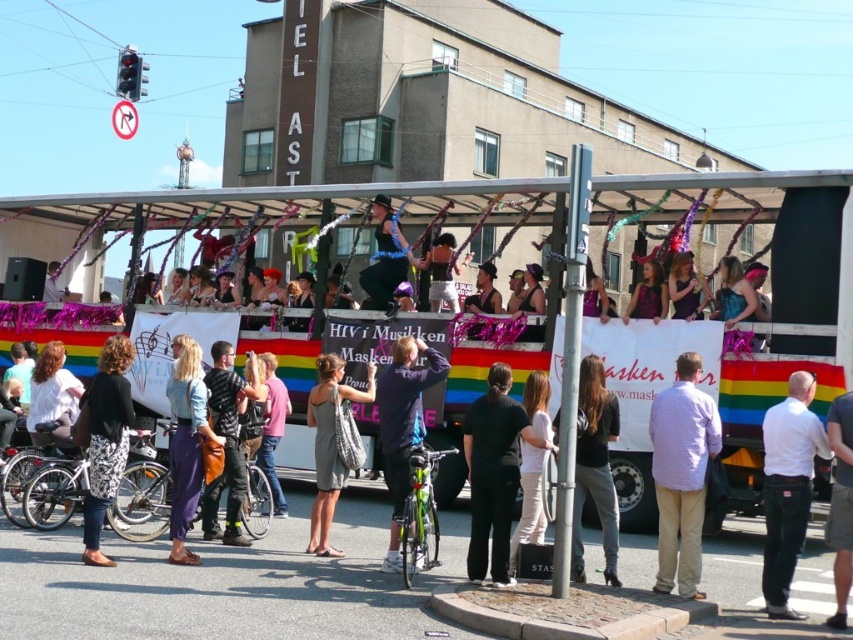
Question: Can you confirm if black matte pants at center is positioned to the left of pink fabric dress at center?

Choices:
 (A) no
 (B) yes

Answer: (A)

Question: Is light gray fabric bag at center below white matte shirt at center?

Choices:
 (A) yes
 (B) no

Answer: (A)

Question: Is matte purple pants at lower left above pink fabric dress at center?

Choices:
 (A) no
 (B) yes

Answer: (B)

Question: Which object is closer to the camera taking this photo?

Choices:
 (A) white cotton shirt at center
 (B) shiny blue dress at center
 (C) light purple checkered shirt at center

Answer: (A)

Question: Based on their relative distances, which object is farther from the white glossy float at center?

Choices:
 (A) shiny blue dress at center
 (B) black printed skirt at lower left

Answer: (B)

Question: Which object appears closest to the camera in this image?

Choices:
 (A) white cotton shirt at center
 (B) shiny blue dress at center
 (C) white matte shirt at center
 (D) pink fabric dress at center

Answer: (A)